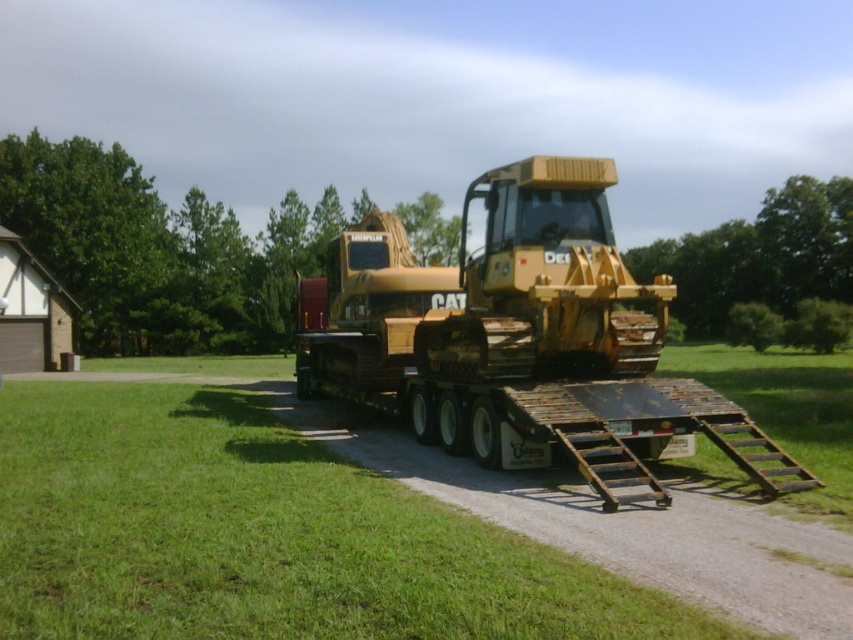
From the picture: You are a delivery driver who needs to unload the yellow metallic tractor at center from the flatbed trailer. The ramp at the back of the trailer is 8 meters long. Can you safely drive the tractor down the ramp to the green grass at lower left without the tractor getting stuck?

The green grass at lower left is 7.40 meters from the yellow metallic tractor at center. Since the ramp is 8 meters long, which is longer than the distance between them, the tractor can safely descend the ramp to the green grass at lower left without getting stuck.

You are standing at the origin point of the image coordinate system. The bulldozer is in the center. Where is the green grass at lower left located in terms of coordinates?

The green grass at lower left is located at coordinates point (263, 536).